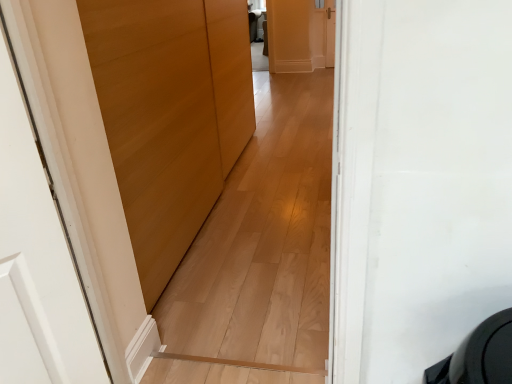
The width and height of the screenshot is (512, 384). In order to click on matte wood door at left in this screenshot , I will do `click(170, 115)`.

This screenshot has height=384, width=512. Describe the element at coordinates (170, 115) in the screenshot. I see `matte wood door at left` at that location.

Locate an element on the screen. The width and height of the screenshot is (512, 384). matte wood door at left is located at coordinates (170, 115).